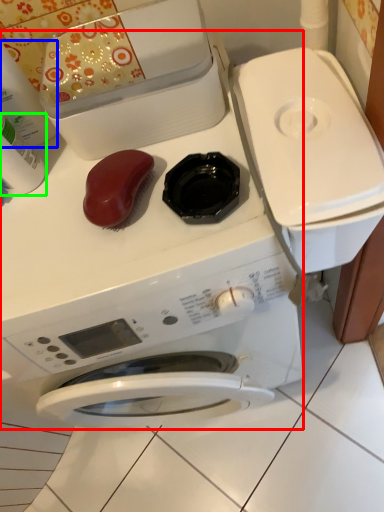
Question: Which object is positioned farthest from washing machine (highlighted by a red box)? Select from cleaning product (highlighted by a blue box) and cleaning product (highlighted by a green box).

Choices:
 (A) cleaning product
 (B) cleaning product

Answer: (A)